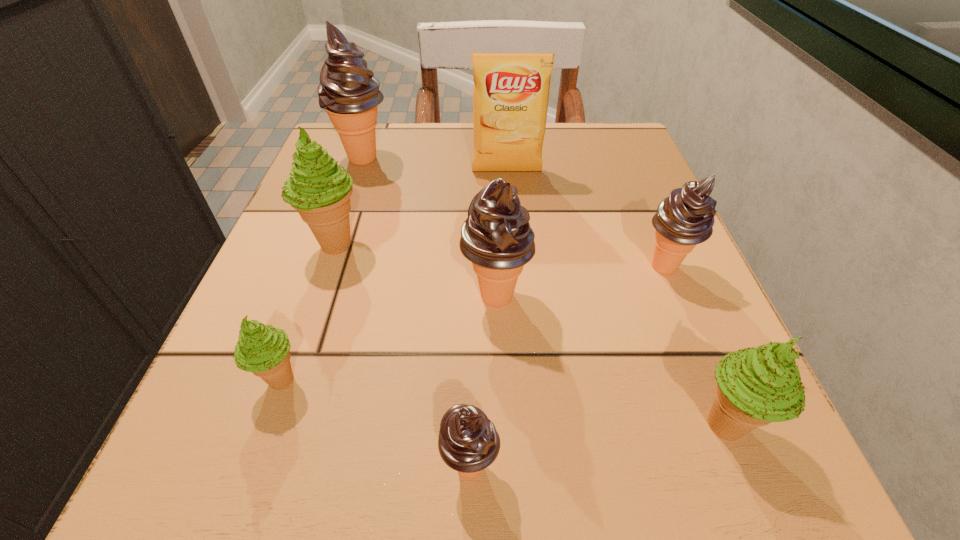
What are the coordinates of `object at the near right corner` in the screenshot? It's located at (755, 386).

The height and width of the screenshot is (540, 960). What are the coordinates of `free location at the far edge` in the screenshot? It's located at pos(447,161).

In the image, there is a desktop. Identify the location of free space at the near edge. The height and width of the screenshot is (540, 960). (444, 519).

The height and width of the screenshot is (540, 960). In order to click on blank area at the left edge in this screenshot , I will do `click(387, 185)`.

This screenshot has height=540, width=960. In the image, there is a desktop. What are the coordinates of `vacant space at the right edge` in the screenshot? It's located at pos(634,207).

Where is `vacant area at the far left corner of the desktop`? The image size is (960, 540). vacant area at the far left corner of the desktop is located at coordinates (396, 136).

I want to click on vacant space at the near left corner of the desktop, so click(151, 509).

Image resolution: width=960 pixels, height=540 pixels. Identify the location of vacant space at the far right corner of the desktop. (583, 156).

Image resolution: width=960 pixels, height=540 pixels. In the image, there is a desktop. Find the location of `vacant space at the near right corner`. vacant space at the near right corner is located at coordinates (658, 436).

Where is `free space between the second smallest green icecream and the second biggest chocolate icecream`? This screenshot has height=540, width=960. free space between the second smallest green icecream and the second biggest chocolate icecream is located at coordinates (610, 361).